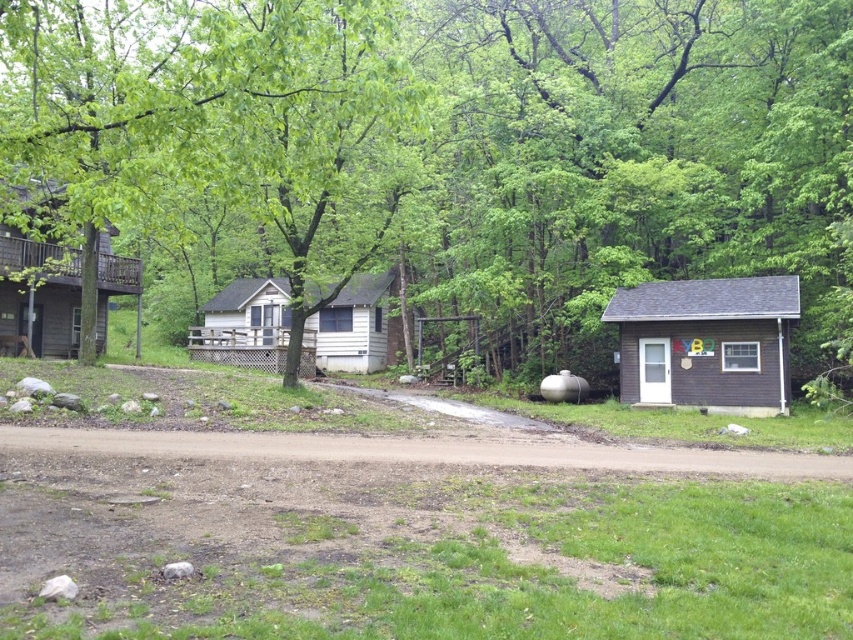
Looking at this image, how much distance is there between green leafy tree at center and brown wood cabin at right?

They are 8.11 meters apart.

This screenshot has height=640, width=853. What do you see at coordinates (457, 141) in the screenshot?
I see `green leafy tree at center` at bounding box center [457, 141].

Locate an element on the screen. The width and height of the screenshot is (853, 640). green leafy tree at center is located at coordinates (457, 141).

You are a GUI agent. You are given a task and a screenshot of the screen. Output one action in this format:
    pyautogui.click(x=<x>, y=<y>)
    Task: Click on the brown wood cabin at right
    
    Given the screenshot: What is the action you would take?
    (706, 342)

Who is taller, brown wood cabin at right or wooden cabin at left?

Standing taller between the two is wooden cabin at left.

Is point (692, 364) in front of point (9, 296)?

That is True.

You are a GUI agent. You are given a task and a screenshot of the screen. Output one action in this format:
    pyautogui.click(x=<x>, y=<y>)
    Task: Click on the brown wood cabin at right
    The width and height of the screenshot is (853, 640).
    Given the screenshot: What is the action you would take?
    pyautogui.click(x=706, y=342)

Is wooden cabin at left wider than light beige wood cabin at center?

Yes, wooden cabin at left is wider than light beige wood cabin at center.

Is wooden cabin at left closer to the viewer compared to light beige wood cabin at center?

Yes, it is.

Where is `wooden cabin at left`? wooden cabin at left is located at coordinates (61, 288).